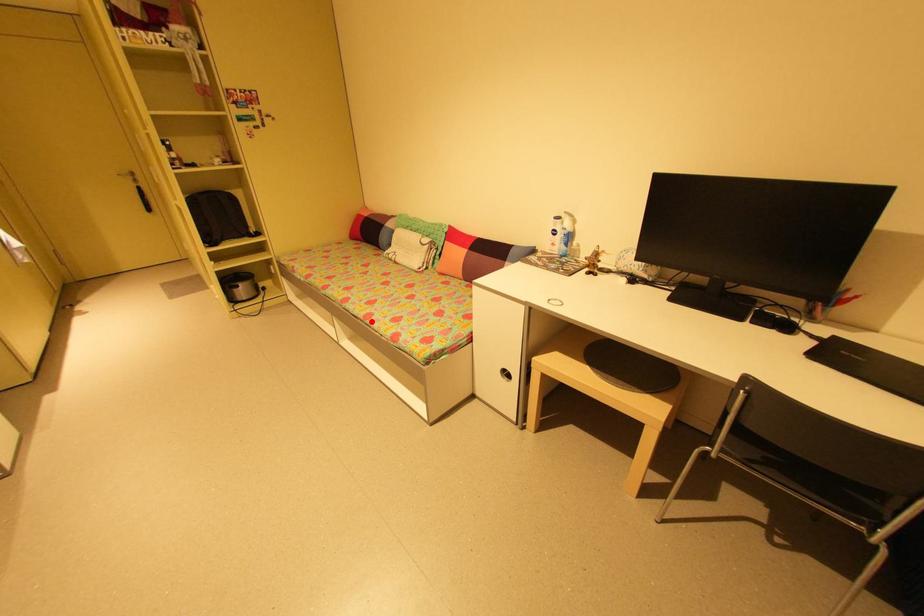
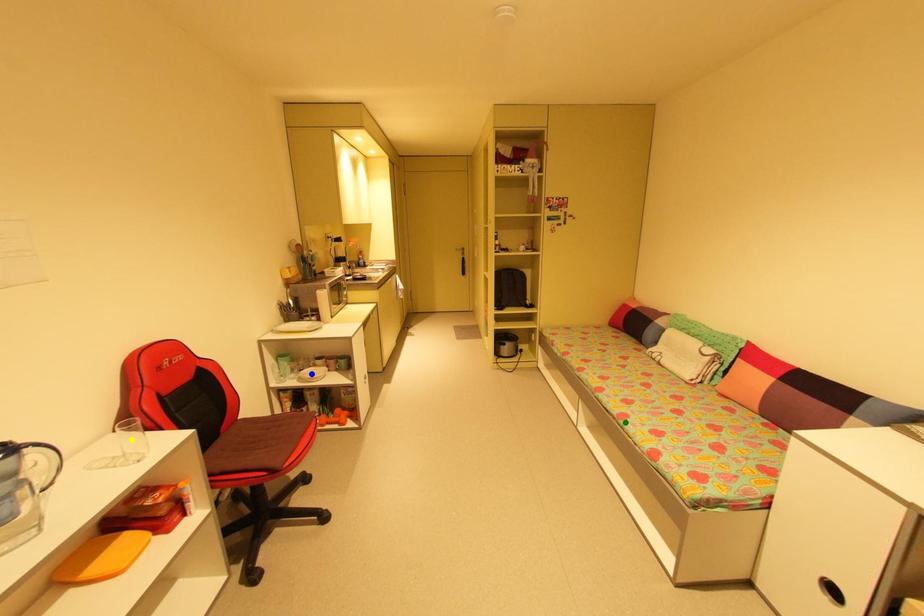
Question: I am providing you with two images of the same scene from different viewpoints. A red point is marked on the first image. You are given multiple points on the second image. In image 2, which mark is for the same physical point as the one in image 1?

Choices:
 (A) blue point
 (B) green point
 (C) yellow point

Answer: (B)